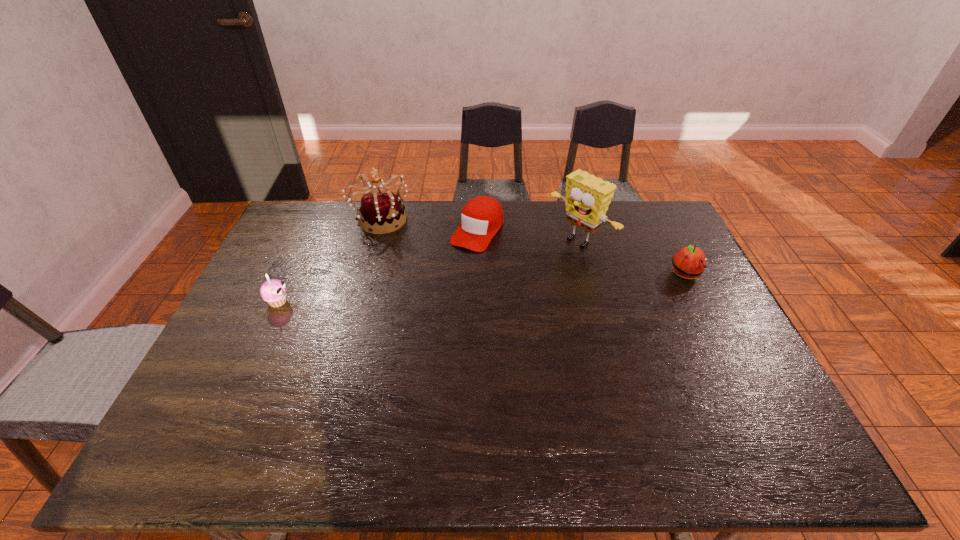
Identify the location of free spot on the desktop that is between the cupcake and the rightmost object and is positioned on the front-facing side of the second object from right to left. (516, 286).

The image size is (960, 540). What are the coordinates of `free space on the desktop that is between the nearest object and the rightmost object and is positioned on the front-facing side of the baseball cap` in the screenshot? It's located at (432, 292).

Where is `free space on the desktop that is between the leftmost object and the second nearest object and is positioned on the front-facing side of the second object from left to right`? Image resolution: width=960 pixels, height=540 pixels. free space on the desktop that is between the leftmost object and the second nearest object and is positioned on the front-facing side of the second object from left to right is located at coordinates (470, 289).